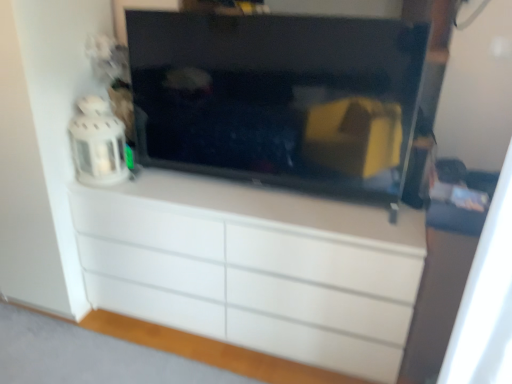
What do you see at coordinates (279, 98) in the screenshot?
I see `black glossy tv at center` at bounding box center [279, 98].

This screenshot has height=384, width=512. What are the coordinates of `black glossy tv at center` in the screenshot? It's located at (279, 98).

Identify the location of curtain in front of the black glossy tv at center. This screenshot has height=384, width=512. (486, 300).

Who is smaller, white fabric curtain at right or black glossy tv at center?

Smaller between the two is white fabric curtain at right.

Are white fabric curtain at right and black glossy tv at center located far from each other?

white fabric curtain at right is far away from black glossy tv at center.

Is white fabric curtain at right oriented towards black glossy tv at center?

No, white fabric curtain at right is not oriented towards black glossy tv at center.

Is black glossy tv at center to the right of white fabric curtain at right from the viewer's perspective?

Incorrect, black glossy tv at center is not on the right side of white fabric curtain at right.

Between black glossy tv at center and white fabric curtain at right, which one has larger width?

With larger width is white fabric curtain at right.

Based on the photo, is black glossy tv at center far from white fabric curtain at right?

That's right, there is a large distance between black glossy tv at center and white fabric curtain at right.

Considering the sizes of objects black glossy tv at center and white fabric curtain at right in the image provided, who is bigger, black glossy tv at center or white fabric curtain at right?

Bigger between the two is black glossy tv at center.

In the image, is white fabric curtain at right positioned in front of or behind white glossy chest of drawers at center?

white fabric curtain at right is in front of white glossy chest of drawers at center.

From a real-world perspective, who is located lower, white fabric curtain at right or white glossy chest of drawers at center?

From a 3D spatial view, white glossy chest of drawers at center is below.

Is white fabric curtain at right oriented away from white glossy chest of drawers at center?

white fabric curtain at right does not have its back to white glossy chest of drawers at center.

Considering the points (452, 369) and (116, 206), which point is in front, point (452, 369) or point (116, 206)?

The point (452, 369) is closer to the camera.

Which is behind, black glossy tv at center or white glossy chest of drawers at center?

Positioned behind is white glossy chest of drawers at center.

Considering the positions of point (288, 143) and point (351, 358), is point (288, 143) closer or farther from the camera than point (351, 358)?

Point (288, 143) appears to be closer to the viewer than point (351, 358).

Measure the distance from black glossy tv at center to white glossy chest of drawers at center.

black glossy tv at center and white glossy chest of drawers at center are 16.64 inches apart.

How many degrees apart are the facing directions of black glossy tv at center and white glossy chest of drawers at center?

The angle between the facing direction of black glossy tv at center and the facing direction of white glossy chest of drawers at center is 0.00103 degrees.

Is white glossy chest of drawers at center inside the boundaries of white fabric curtain at right, or outside?

white glossy chest of drawers at center is not enclosed by white fabric curtain at right.

Is white glossy chest of drawers at center facing away from white fabric curtain at right?

No.

From a real-world perspective, is white glossy chest of drawers at center physically above white fabric curtain at right?

No, from a real-world perspective, white glossy chest of drawers at center is not above white fabric curtain at right.

Considering the sizes of objects white glossy chest of drawers at center and white fabric curtain at right in the image provided, who is smaller, white glossy chest of drawers at center or white fabric curtain at right?

white fabric curtain at right.

Is white glossy chest of drawers at center positioned in front of black glossy tv at center?

No, it is not.

Consider the image. Considering the sizes of objects white glossy chest of drawers at center and black glossy tv at center in the image provided, who is taller, white glossy chest of drawers at center or black glossy tv at center?

white glossy chest of drawers at center.

Is white glossy chest of drawers at center turned away from black glossy tv at center?

No, white glossy chest of drawers at center is not facing the opposite direction of black glossy tv at center.

Can you confirm if white glossy chest of drawers at center is thinner than black glossy tv at center?

No.

Locate an element on the screen. The height and width of the screenshot is (384, 512). curtain lying on the right of black glossy tv at center is located at coordinates (486, 300).

What are the coordinates of `curtain below the black glossy tv at center (from a real-world perspective)` in the screenshot? It's located at (x=486, y=300).

Based on their spatial positions, is black glossy tv at center or white fabric curtain at right further from white glossy chest of drawers at center?

The object further to white glossy chest of drawers at center is white fabric curtain at right.

Estimate the real-world distances between objects in this image. Which object is closer to black glossy tv at center, white fabric curtain at right or white glossy chest of drawers at center?

white glossy chest of drawers at center lies closer to black glossy tv at center than the other object.

Considering their positions, is white fabric curtain at right positioned closer to white glossy chest of drawers at center than black glossy tv at center?

black glossy tv at center is closer to white glossy chest of drawers at center.

Considering their positions, is black glossy tv at center positioned further to white fabric curtain at right than white glossy chest of drawers at center?

black glossy tv at center lies further to white fabric curtain at right than the other object.

When comparing their distances from white fabric curtain at right, does white glossy chest of drawers at center or black glossy tv at center seem closer?

Based on the image, white glossy chest of drawers at center appears to be nearer to white fabric curtain at right.

Estimate the real-world distances between objects in this image. Which object is closer to black glossy tv at center, white glossy chest of drawers at center or white fabric curtain at right?

Among the two, white glossy chest of drawers at center is located nearer to black glossy tv at center.

Locate an element on the screen. The image size is (512, 384). television between white fabric curtain at right and white glossy chest of drawers at center along the z-axis is located at coordinates (279, 98).